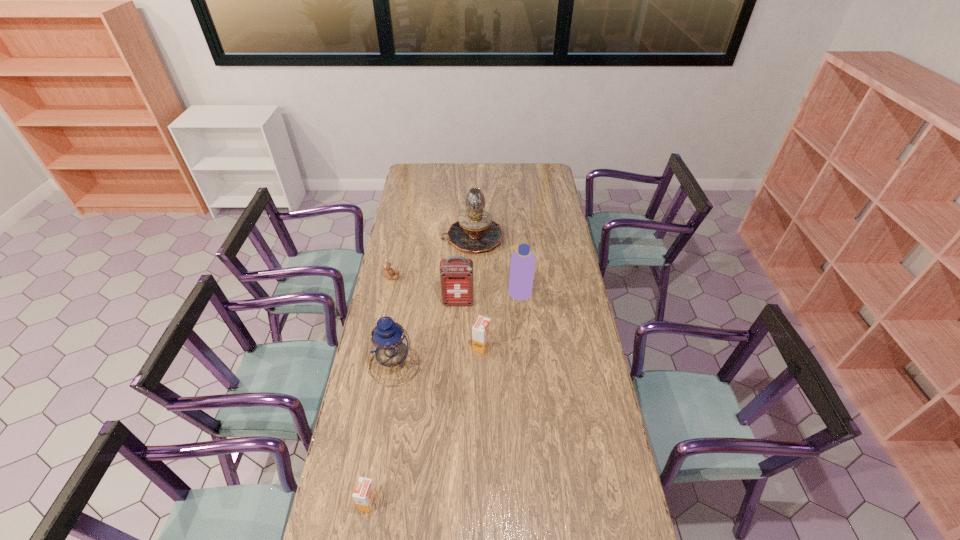
Image resolution: width=960 pixels, height=540 pixels. Identify the location of object situated at the near left corner. (365, 494).

In the image, there is a desktop. Identify the location of vacant area at the far edge. (466, 171).

The image size is (960, 540). I want to click on vacant space at the near edge, so click(x=466, y=508).

Locate an element on the screen. The width and height of the screenshot is (960, 540). vacant region at the left edge of the desktop is located at coordinates (421, 204).

This screenshot has height=540, width=960. In order to click on vacant space at the right edge of the desktop in this screenshot , I will do `click(554, 197)`.

The image size is (960, 540). Find the location of `free region at the far left corner of the desktop`. free region at the far left corner of the desktop is located at coordinates (416, 180).

Locate an element on the screen. The width and height of the screenshot is (960, 540). vacant space at the far right corner of the desktop is located at coordinates (527, 166).

At what (x,y) coordinates should I click in order to perform the action: click on blank region between the oil lamp and the rightmost object. Please return your answer as a coordinate pair (x, y). Looking at the image, I should click on (496, 264).

Where is `empty location between the right orange juice and the first-aid kit`? The image size is (960, 540). empty location between the right orange juice and the first-aid kit is located at coordinates (469, 325).

You are a GUI agent. You are given a task and a screenshot of the screen. Output one action in this format:
    pyautogui.click(x=<x>, y=<y>)
    Task: Click on the free point between the lantern and the left orange juice
    This screenshot has width=960, height=540.
    Given the screenshot: What is the action you would take?
    pyautogui.click(x=381, y=434)